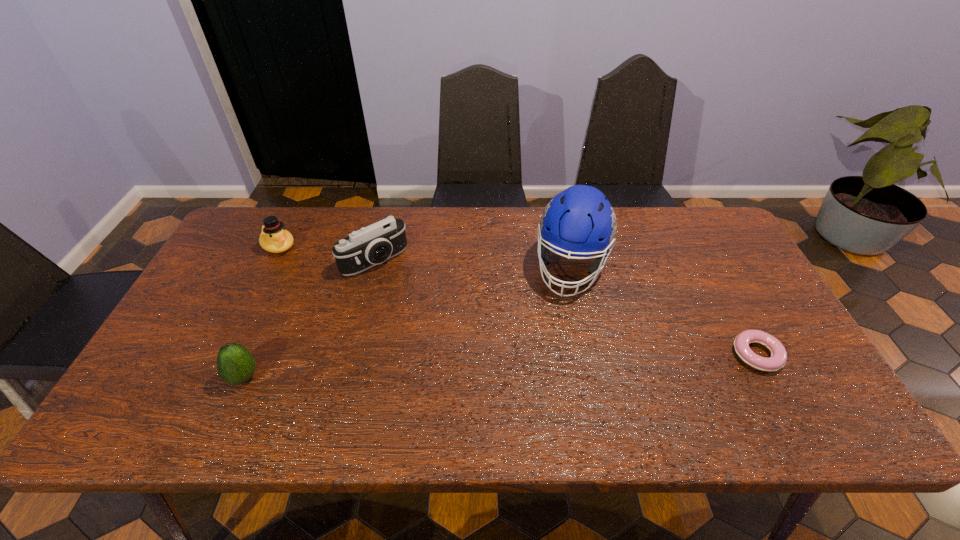
The height and width of the screenshot is (540, 960). I want to click on free spot between the doughnut and the third object from left to right, so click(x=565, y=307).

I want to click on object that is the third closest to the duck, so click(x=580, y=221).

The width and height of the screenshot is (960, 540). In order to click on object that is the second nearest to the avocado in this screenshot , I will do `click(274, 238)`.

The width and height of the screenshot is (960, 540). Find the location of `vacant space that satisfies the following two spatial constraints: 1. on the front side of the camera; 2. on the left side of the football helmet`. vacant space that satisfies the following two spatial constraints: 1. on the front side of the camera; 2. on the left side of the football helmet is located at coordinates (373, 267).

At what (x,y) coordinates should I click in order to perform the action: click on vacant point that satisfies the following two spatial constraints: 1. on the front side of the fourth object from left to right; 2. on the right side of the third object from left to right. Please return your answer as a coordinate pair (x, y). This screenshot has height=540, width=960. Looking at the image, I should click on (373, 267).